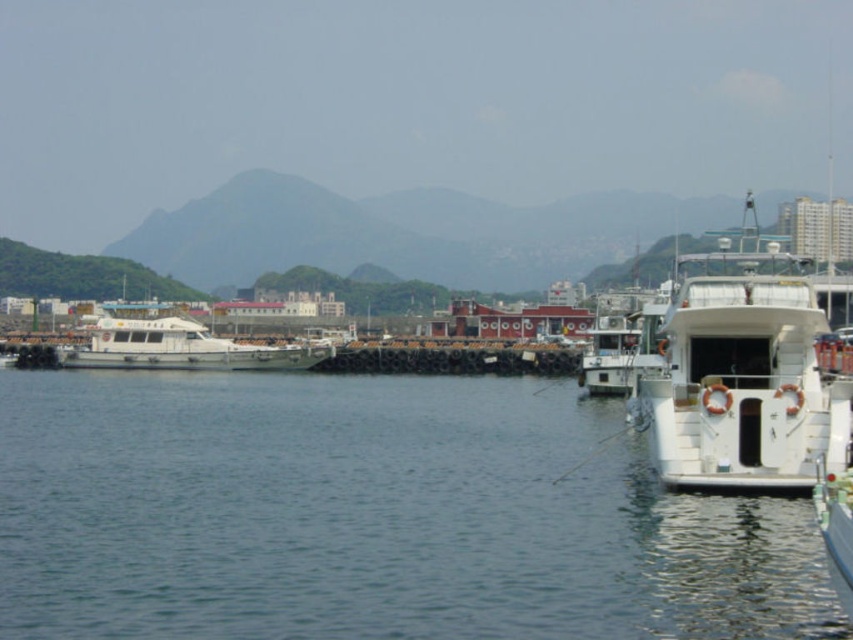
You are standing on the pier and see the clear water at lower left and the white matte boat at left. Which object is closer to your feet?

The clear water at lower left is closer to your feet because it is located below the white matte boat at left, placing it nearer to the pier where you are standing.

You are standing at the edge of the harbor and want to take a photo of the clear water at lower left and the white matte boat at left. Which object will appear closer to the camera in your photo?

The clear water at lower left will appear closer to the camera in the photo because it is in front of the white matte boat at left.

In the scene shown: You are a delivery drone with a wingspan of 1.5 meters. You need to fly from the clear water at lower left to the white matte boat at left. Is there enough space for you to pass through the area between them?

The distance between the clear water at lower left and the white matte boat at left is 23.49 meters, so yes, the drone can safely pass through since its wingspan of 1.5 meters is much smaller than the available space.